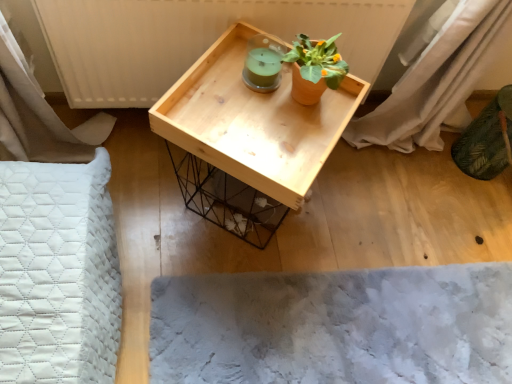
Where is `free space in front of terracotta clay pot at upper center`? free space in front of terracotta clay pot at upper center is located at coordinates (284, 140).